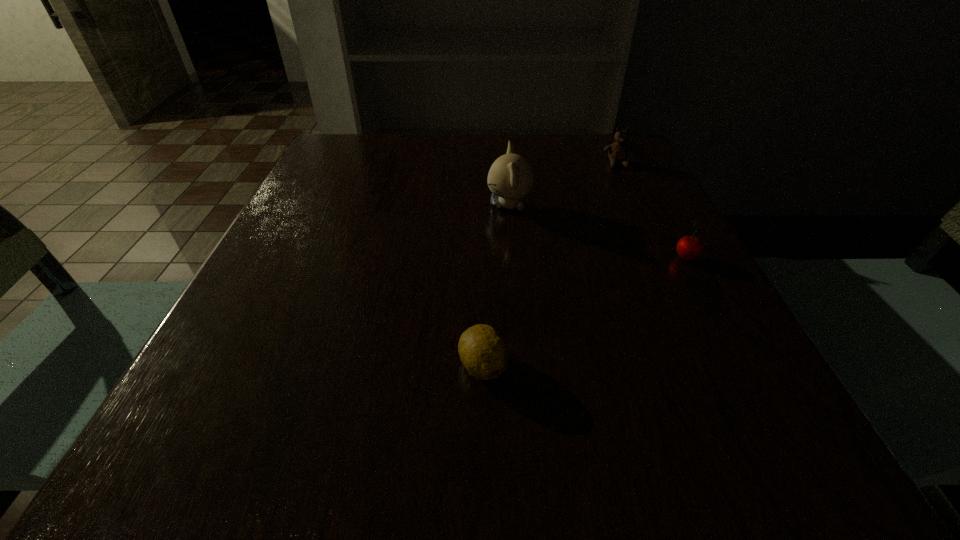
Image resolution: width=960 pixels, height=540 pixels. What are the coordinates of `free space between the third nearest object and the second nearest object` in the screenshot? It's located at (597, 232).

Identify the location of free spot between the cherry and the shortest object. The height and width of the screenshot is (540, 960). (585, 312).

You are a GUI agent. You are given a task and a screenshot of the screen. Output one action in this format:
    pyautogui.click(x=<x>, y=<y>)
    Task: Click on the vacant area between the kitten and the cherry
    This screenshot has width=960, height=540.
    Given the screenshot: What is the action you would take?
    click(597, 232)

You are a GUI agent. You are given a task and a screenshot of the screen. Output one action in this format:
    pyautogui.click(x=<x>, y=<y>)
    Task: Click on the vacant space that's between the kitten and the nearest object
    The image size is (960, 540).
    Given the screenshot: What is the action you would take?
    pyautogui.click(x=496, y=286)

Where is `object that stands as the closest to the lemon`? Image resolution: width=960 pixels, height=540 pixels. object that stands as the closest to the lemon is located at coordinates (510, 177).

Locate an element on the screen. object that is the third nearest to the second nearest object is located at coordinates (482, 350).

This screenshot has width=960, height=540. Identify the location of free space that satisfies the following two spatial constraints: 1. on the front-facing side of the third farthest object; 2. on the left side of the teddy bear. (663, 259).

I want to click on vacant area in the image that satisfies the following two spatial constraints: 1. on the face of the tallest object; 2. on the right side of the cherry, so click(514, 259).

Where is `vacant space that satisfies the following two spatial constraints: 1. on the face of the tallest object; 2. at the stem end of the shortest object`? The image size is (960, 540). vacant space that satisfies the following two spatial constraints: 1. on the face of the tallest object; 2. at the stem end of the shortest object is located at coordinates (523, 365).

This screenshot has width=960, height=540. What are the coordinates of `vacant space that satisfies the following two spatial constraints: 1. on the face of the third nearest object; 2. at the stem end of the shortest object` in the screenshot? It's located at (523, 365).